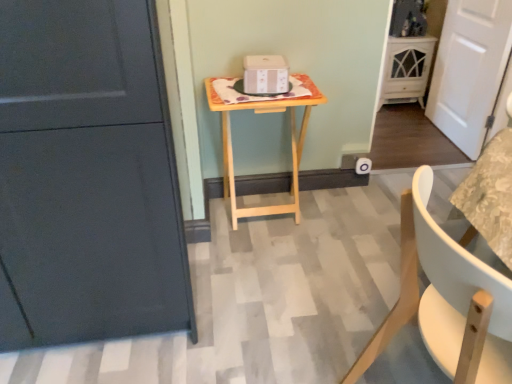
The image size is (512, 384). In order to click on light wood/texture table at center in this screenshot , I will do `click(291, 144)`.

The image size is (512, 384). Describe the element at coordinates (469, 70) in the screenshot. I see `white wooden door at right` at that location.

Locate an element on the screen. This screenshot has height=384, width=512. white glossy cabinet at upper right is located at coordinates (406, 69).

Where is `light wood/texture table at center`? Image resolution: width=512 pixels, height=384 pixels. light wood/texture table at center is located at coordinates (291, 144).

Is light wood/texture table at center located outside white wooden door at right?

That's correct, light wood/texture table at center is outside of white wooden door at right.

From the image's perspective, which one is positioned higher, light wood/texture table at center or white wooden door at right?

white wooden door at right.

Find the location of a particular element. This screenshot has width=512, height=384. door behind the light wood/texture table at center is located at coordinates (469, 70).

From a real-world perspective, who is located lower, light wood/texture table at center or white wooden door at right?

light wood/texture table at center is physically lower.

Is white glossy cabinet at upper right positioned with its back to white wood chair at lower right?

No, white glossy cabinet at upper right is not facing the opposite direction of white wood chair at lower right.

Considering the positions of point (401, 90) and point (483, 349), is point (401, 90) closer or farther from the camera than point (483, 349)?

Point (401, 90).

Looking at this image, is white glossy cabinet at upper right in front of white wood chair at lower right?

No.

Does white glossy cabinet at upper right have a larger size compared to white wood chair at lower right?

No.

Relative to white wood chair at lower right, is white wooden door at right in front or behind?

Clearly, white wooden door at right is behind white wood chair at lower right.

Based on the photo, is white wooden door at right far from white wood chair at lower right?

Yes, white wooden door at right and white wood chair at lower right are located far from each other.

From the picture: Is white wooden door at right taller than white wood chair at lower right?

Correct, white wooden door at right is much taller as white wood chair at lower right.

Is white wooden door at right bigger than white wood chair at lower right?

No.

Which is nearer, (295, 158) or (412, 85)?

The point (295, 158) is more forward.

Is light wood/texture table at center to the left or to the right of white glossy cabinet at upper right in the image?

light wood/texture table at center is to the left of white glossy cabinet at upper right.

Is light wood/texture table at center outside of white glossy cabinet at upper right?

Yes, light wood/texture table at center is not within white glossy cabinet at upper right.

Does light wood/texture table at center turn towards white glossy cabinet at upper right?

No, light wood/texture table at center does not turn towards white glossy cabinet at upper right.

Is white wooden door at right far from white glossy cabinet at upper right?

No.

Is white wooden door at right not within white glossy cabinet at upper right?

Absolutely, white wooden door at right is external to white glossy cabinet at upper right.

Which point is more distant from viewer, (445, 107) or (401, 60)?

The point (401, 60) is more distant.

Is white wooden door at right smaller than white glossy cabinet at upper right?

Indeed, white wooden door at right has a smaller size compared to white glossy cabinet at upper right.

Is light wood/texture table at center a part of white wood chair at lower right?

Actually, light wood/texture table at center is outside white wood chair at lower right.

Locate an element on the screen. This screenshot has width=512, height=384. chair located on the right of light wood/texture table at center is located at coordinates (447, 300).

Is white wood chair at lower right at the right side of light wood/texture table at center?

Yes, white wood chair at lower right is to the right of light wood/texture table at center.

How different are the orientations of white wood chair at lower right and light wood/texture table at center in degrees?

The angular difference between white wood chair at lower right and light wood/texture table at center is 89.4 degrees.

Are white glossy cabinet at upper right and light wood/texture table at center far apart?

That's right, there is a large distance between white glossy cabinet at upper right and light wood/texture table at center.

Is white glossy cabinet at upper right turned away from light wood/texture table at center?

white glossy cabinet at upper right does not have its back to light wood/texture table at center.

Where is `table to the left of white glossy cabinet at upper right`? Image resolution: width=512 pixels, height=384 pixels. table to the left of white glossy cabinet at upper right is located at coordinates coord(291,144).

Between white glossy cabinet at upper right and light wood/texture table at center, which one has larger size?

With larger size is light wood/texture table at center.

Identify the location of table below the white wooden door at right (from a real-world perspective). (291, 144).

Where is `cabinetry on the right side of white wood chair at lower right`? This screenshot has height=384, width=512. cabinetry on the right side of white wood chair at lower right is located at coordinates (406, 69).

Looking at the image, which one is located further to white wooden door at right, white wood chair at lower right or light wood/texture table at center?

The object further to white wooden door at right is white wood chair at lower right.

Estimate the real-world distances between objects in this image. Which object is further from light wood/texture table at center, white glossy cabinet at upper right or white wooden door at right?

white glossy cabinet at upper right lies further to light wood/texture table at center than the other object.

Based on their spatial positions, is light wood/texture table at center or white wood chair at lower right further from white wooden door at right?

white wood chair at lower right is positioned further to the anchor white wooden door at right.

Consider the image. Considering their positions, is white wooden door at right positioned further to light wood/texture table at center than white glossy cabinet at upper right?

Based on the image, white glossy cabinet at upper right appears to be further to light wood/texture table at center.

Estimate the real-world distances between objects in this image. Which object is further from white wooden door at right, white wood chair at lower right or white glossy cabinet at upper right?

Based on the image, white wood chair at lower right appears to be further to white wooden door at right.

Looking at the image, which one is located closer to light wood/texture table at center, white wood chair at lower right or white glossy cabinet at upper right?

white wood chair at lower right is positioned closer to the anchor light wood/texture table at center.

Looking at the image, which one is located closer to light wood/texture table at center, white glossy cabinet at upper right or white wood chair at lower right?

Among the two, white wood chair at lower right is located nearer to light wood/texture table at center.

Considering their positions, is white glossy cabinet at upper right positioned closer to white wood chair at lower right than light wood/texture table at center?

Among the two, light wood/texture table at center is located nearer to white wood chair at lower right.

This screenshot has width=512, height=384. I want to click on table between white wood chair at lower right and white wooden door at right along the z-axis, so click(x=291, y=144).

Find the location of `table located between white wood chair at lower right and white glossy cabinet at upper right in the depth direction`. table located between white wood chair at lower right and white glossy cabinet at upper right in the depth direction is located at coordinates (291, 144).

Identify the location of door between light wood/texture table at center and white glossy cabinet at upper right from front to back. This screenshot has height=384, width=512. (469, 70).

Find the location of `door positioned between white wood chair at lower right and white glossy cabinet at upper right from near to far`. door positioned between white wood chair at lower right and white glossy cabinet at upper right from near to far is located at coordinates (469, 70).